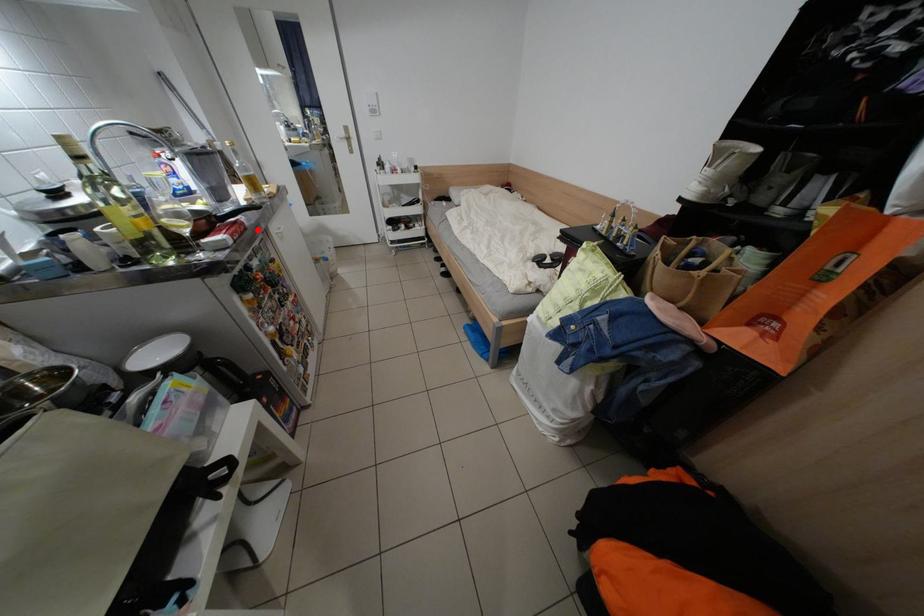
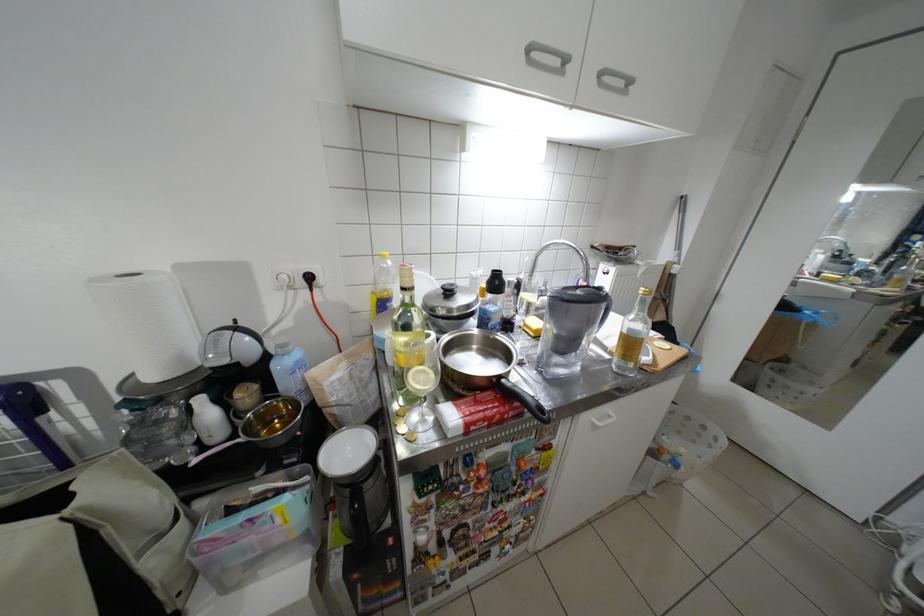
Where in the second image is the point corresponding to the highlighted location from the first image?

(532, 415)